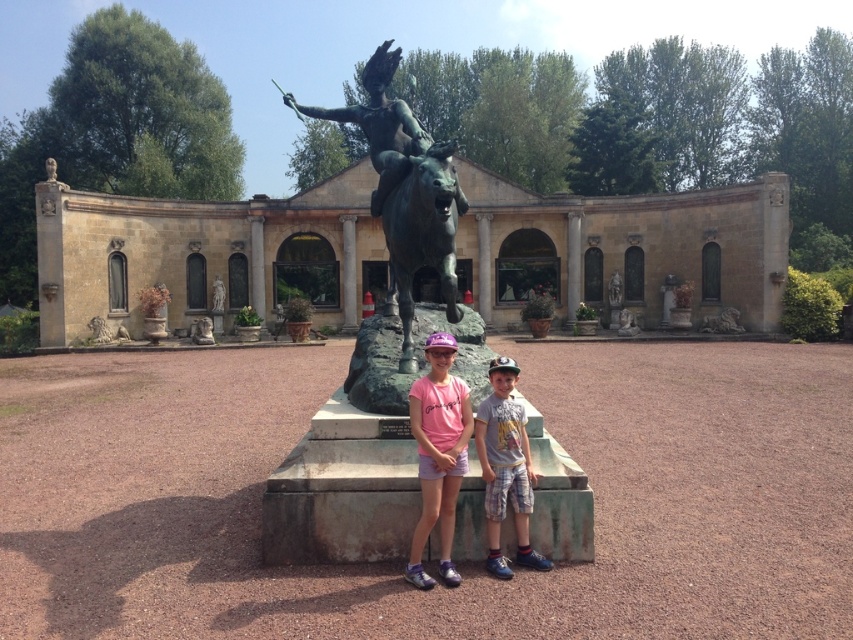
Does stone building at center appear over bronze statue at center?

No.

Is stone building at center to the right of bronze statue at center from the viewer's perspective?

Indeed, stone building at center is positioned on the right side of bronze statue at center.

I want to click on stone building at center, so click(x=202, y=253).

Which is below, pink fabric shirt at center or gray cotton shirt at center?

gray cotton shirt at center is lower down.

Between pink fabric shirt at center and gray cotton shirt at center, which one has more height?

Standing taller between the two is pink fabric shirt at center.

Measure the distance between point (x=440, y=394) and camera.

Point (x=440, y=394) is 19.16 feet away from camera.

Where is `pink fabric shirt at center`? This screenshot has height=640, width=853. pink fabric shirt at center is located at coordinates (438, 452).

Consider the image. Who is higher up, stone building at center or pink fabric shirt at center?

stone building at center is higher up.

Does point (317, 273) lie in front of point (421, 586)?

No, (317, 273) is behind (421, 586).

Identify the location of stone building at center. (202, 253).